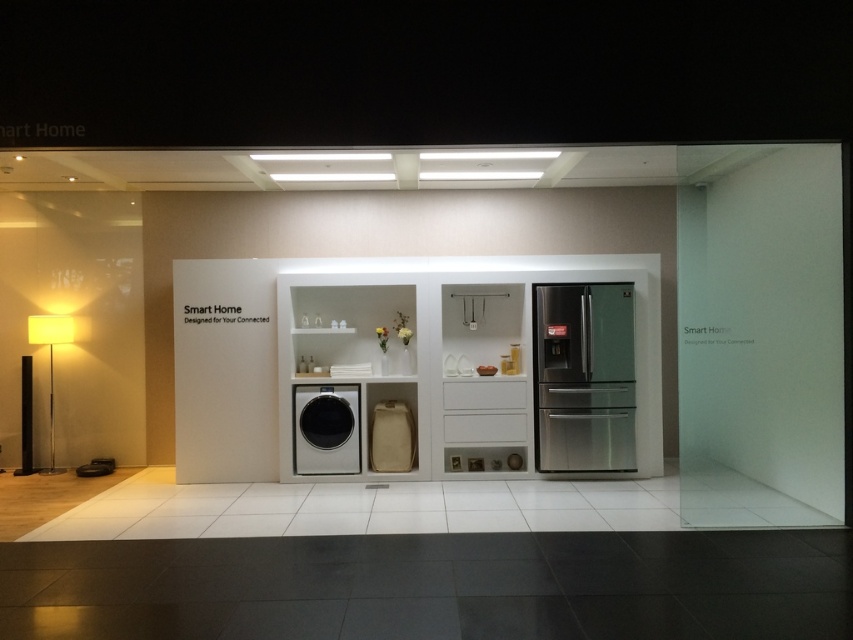
What are the coordinates of `sleek metallic washing machine at center` in the screenshot? It's located at (325, 429).

In the scene shown: Which of these two, sleek metallic washing machine at center or matte white floor lamp at left, stands shorter?

With less height is matte white floor lamp at left.

Which is in front, point (302, 448) or point (35, 330)?

Point (302, 448) is in front.

Locate an element on the screen. The height and width of the screenshot is (640, 853). sleek metallic washing machine at center is located at coordinates (325, 429).

Between stainless steel refrigerator at center and sleek metallic washing machine at center, which one has more height?

Standing taller between the two is stainless steel refrigerator at center.

Can you confirm if stainless steel refrigerator at center is wider than sleek metallic washing machine at center?

Yes, stainless steel refrigerator at center is wider than sleek metallic washing machine at center.

Is point (538, 392) closer to viewer compared to point (340, 451)?

That is False.

The width and height of the screenshot is (853, 640). In order to click on stainless steel refrigerator at center in this screenshot , I will do tap(583, 378).

Based on the photo, does stainless steel refrigerator at center appear over matte white floor lamp at left?

No.

Who is positioned more to the left, stainless steel refrigerator at center or matte white floor lamp at left?

matte white floor lamp at left

This screenshot has height=640, width=853. Identify the location of stainless steel refrigerator at center. (583, 378).

The height and width of the screenshot is (640, 853). I want to click on stainless steel refrigerator at center, so click(x=583, y=378).